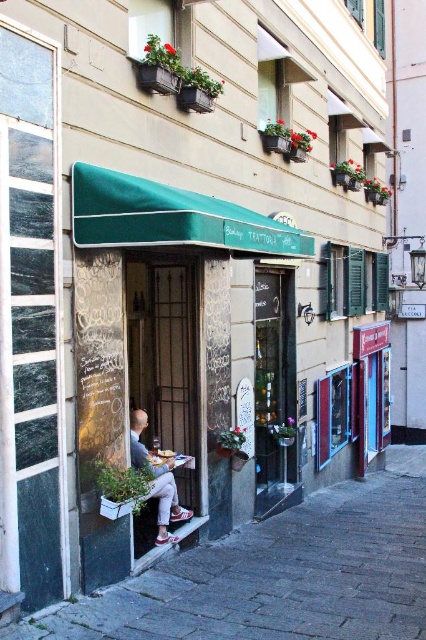
Is paved stone pavement at lower center taller than light gray fabric pants at lower center?

Yes, paved stone pavement at lower center is taller than light gray fabric pants at lower center.

Which is in front, point (405, 618) or point (146, 464)?

Point (405, 618)

Between point (317, 618) and point (172, 492), which one is positioned in front?

Point (317, 618)

This screenshot has height=640, width=426. I want to click on paved stone pavement at lower center, so click(279, 573).